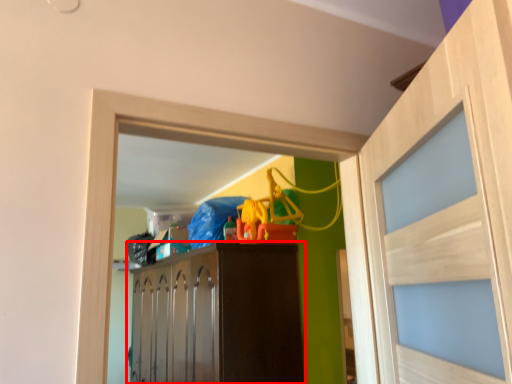
Question: From the image's perspective, where is cabinetry (annotated by the red box) located relative to door?

Choices:
 (A) below
 (B) above

Answer: (A)